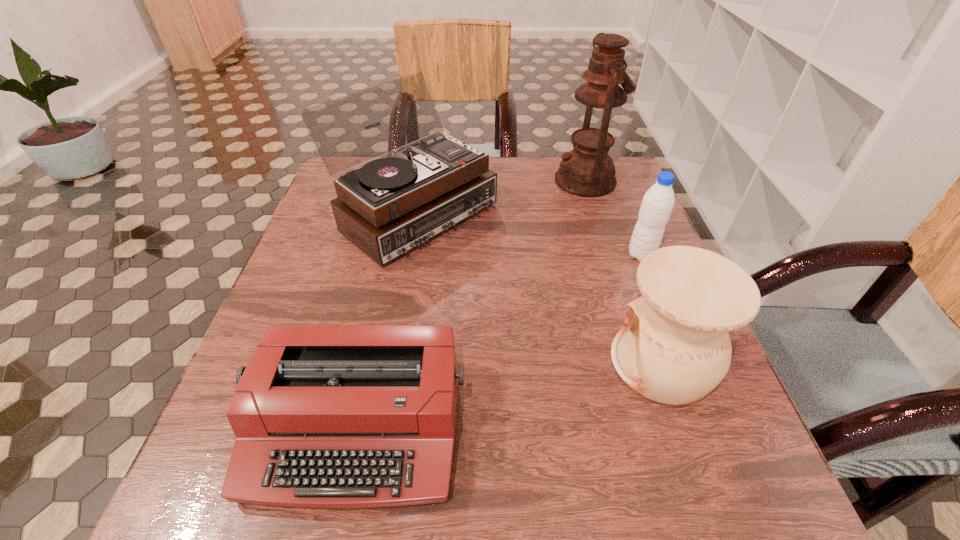
The height and width of the screenshot is (540, 960). Identify the location of the tallest object. (587, 171).

The width and height of the screenshot is (960, 540). I want to click on the second tallest object, so click(x=389, y=206).

Where is `water bottle`? This screenshot has width=960, height=540. water bottle is located at coordinates (658, 202).

This screenshot has width=960, height=540. I want to click on pottery, so click(x=674, y=348).

The image size is (960, 540). Identify the location of the shortest object. (325, 416).

Image resolution: width=960 pixels, height=540 pixels. I want to click on blank area located 0.390m on the front of the tallest object, so click(629, 316).

This screenshot has height=540, width=960. I want to click on vacant area situated 0.200m on the front of the fourth shortest object, so click(389, 345).

The width and height of the screenshot is (960, 540). I want to click on vacant region located 0.400m on the front of the water bottle, so click(x=714, y=438).

The height and width of the screenshot is (540, 960). In order to click on vacant space located 0.190m at the open side of the pottery in this screenshot , I will do tap(504, 363).

Identify the location of vacant area situated at the open side of the pottery. This screenshot has height=540, width=960. (465, 363).